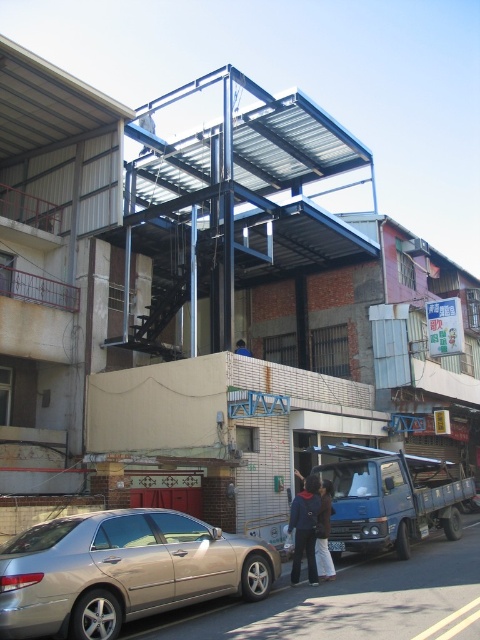
Who is more distant from viewer, (305, 486) or (238, 353)?

Positioned behind is point (238, 353).

Between dark blue jacket at center and blue fabric bag at center, which one is positioned lower?

dark blue jacket at center is lower down.

Is point (300, 564) closer to camera compared to point (236, 348)?

Yes, point (300, 564) is closer to viewer.

Where is `dark blue jacket at center`? dark blue jacket at center is located at coordinates (304, 529).

Is point (17, 563) farther from camera compared to point (296, 556)?

No.

In the scene shown: Measure the distance between gold metallic car at lower left and camera.

A distance of 9.37 meters exists between gold metallic car at lower left and camera.

Who is more distant from viewer, (36, 589) or (299, 497)?

The point (299, 497) is more distant.

Locate an element on the screen. gold metallic car at lower left is located at coordinates (122, 570).

Can you confirm if dark brown leather jacket at center is thinner than blue fabric bag at center?

Yes.

Who is taller, dark brown leather jacket at center or blue fabric bag at center?

dark brown leather jacket at center is taller.

Measure the distance between point (324, 483) and camera.

Point (324, 483) is 15.33 meters from camera.

Identify the location of dark brown leather jacket at center. The height and width of the screenshot is (640, 480). (324, 532).